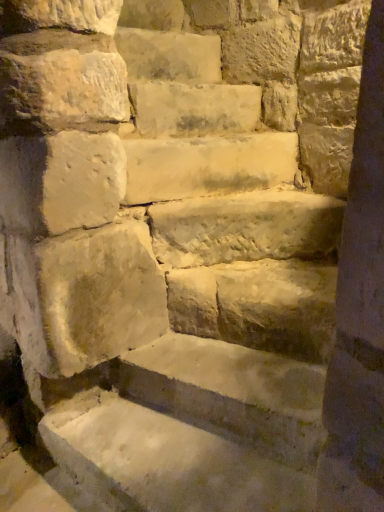
Describe the element at coordinates (245, 227) in the screenshot. The image size is (384, 512). I see `smooth beige stone steps at center` at that location.

What are the coordinates of `light beige stone at center, which is the first brick in bottom-to-top order` in the screenshot? It's located at (193, 108).

What is the approximate width of smooth beige stone at center?

smooth beige stone at center is 14.66 inches wide.

Where is `smooth beige stone steps at center`? This screenshot has height=512, width=384. smooth beige stone steps at center is located at coordinates coord(245,227).

Consider the image. Is light beige stone at upper center, marked as the 1th brick in a top-to-bottom arrangement, positioned with its back to light beige stone at center, the second brick positioned from the top?

No, light beige stone at center, the second brick positioned from the top, is not at the back of light beige stone at upper center, marked as the 1th brick in a top-to-bottom arrangement.

From the image's perspective, is light beige stone at upper center, the second brick in the bottom-to-top sequence, on light beige stone at center, which is the first brick in bottom-to-top order?

Yes, from the image's perspective, light beige stone at upper center, the second brick in the bottom-to-top sequence, is on top of light beige stone at center, which is the first brick in bottom-to-top order.

Are light beige stone at upper center, the second brick in the bottom-to-top sequence, and light beige stone at center, which is the first brick in bottom-to-top order, located far from each other?

No, light beige stone at upper center, the second brick in the bottom-to-top sequence, is not far from light beige stone at center, which is the first brick in bottom-to-top order.

Considering the relative sizes of light beige stone at upper center, marked as the 1th brick in a top-to-bottom arrangement, and light beige stone at center, the second brick positioned from the top, in the image provided, is light beige stone at upper center, marked as the 1th brick in a top-to-bottom arrangement, smaller than light beige stone at center, the second brick positioned from the top,?

Actually, light beige stone at upper center, marked as the 1th brick in a top-to-bottom arrangement, might be larger than light beige stone at center, the second brick positioned from the top.

Is smooth beige stone at center further to the viewer compared to smooth beige stone steps at center?

Yes, the depth of smooth beige stone at center is greater than that of smooth beige stone steps at center.

Who is smaller, smooth beige stone at center or smooth beige stone steps at center?

smooth beige stone at center.

Between smooth beige stone at center and smooth beige stone steps at center, which one has more height?

smooth beige stone at center.

Would you say smooth beige stone at center is a long distance from smooth beige stone steps at center?

smooth beige stone at center is actually quite close to smooth beige stone steps at center.

There is a smooth beige stone at center. In order to click on the 2nd brick above it (from the image's perspective) in this screenshot , I will do `click(170, 55)`.

How different are the orientations of smooth beige stone at center and light beige stone at upper center, marked as the 1th brick in a top-to-bottom arrangement, in degrees?

The facing directions of smooth beige stone at center and light beige stone at upper center, marked as the 1th brick in a top-to-bottom arrangement, are 13.8 degrees apart.

Considering the relative sizes of smooth beige stone at center and light beige stone at upper center, marked as the 1th brick in a top-to-bottom arrangement, in the image provided, is smooth beige stone at center bigger than light beige stone at upper center, marked as the 1th brick in a top-to-bottom arrangement,?

No, smooth beige stone at center is not bigger than light beige stone at upper center, marked as the 1th brick in a top-to-bottom arrangement.

Based on their positions, is smooth beige stone at center located to the left or right of light beige stone at upper center, the second brick in the bottom-to-top sequence?

smooth beige stone at center is positioned on light beige stone at upper center, the second brick in the bottom-to-top sequence,'s right side.

From a real-world perspective, is light beige stone at upper center, marked as the 1th brick in a top-to-bottom arrangement, positioned above or below smooth beige stone steps at center?

Clearly, from a real-world perspective, light beige stone at upper center, marked as the 1th brick in a top-to-bottom arrangement, is above smooth beige stone steps at center.

In the scene shown: From the image's perspective, which object appears higher, light beige stone at upper center, marked as the 1th brick in a top-to-bottom arrangement, or smooth beige stone steps at center?

light beige stone at upper center, marked as the 1th brick in a top-to-bottom arrangement, from the image's perspective.

Visually, is light beige stone at upper center, the second brick in the bottom-to-top sequence, positioned to the left or to the right of smooth beige stone steps at center?

light beige stone at upper center, the second brick in the bottom-to-top sequence, is positioned on smooth beige stone steps at center's left side.

Is light beige stone at upper center, the second brick in the bottom-to-top sequence, positioned far away from smooth beige stone steps at center?

Actually, light beige stone at upper center, the second brick in the bottom-to-top sequence, and smooth beige stone steps at center are a little close together.

From the image's perspective, which one is positioned higher, light beige stone at upper center, marked as the 1th brick in a top-to-bottom arrangement, or smooth beige stone at center?

light beige stone at upper center, marked as the 1th brick in a top-to-bottom arrangement, appears higher in the image.

Could you tell me if light beige stone at upper center, marked as the 1th brick in a top-to-bottom arrangement, is facing smooth beige stone at center?

No, light beige stone at upper center, marked as the 1th brick in a top-to-bottom arrangement, is not aimed at smooth beige stone at center.

From a real-world perspective, is light beige stone at upper center, the second brick in the bottom-to-top sequence, below smooth beige stone at center?

No, from a real-world perspective, light beige stone at upper center, the second brick in the bottom-to-top sequence, is not under smooth beige stone at center.

Between light beige stone at upper center, marked as the 1th brick in a top-to-bottom arrangement, and smooth beige stone at center, which one has smaller width?

Thinner between the two is light beige stone at upper center, marked as the 1th brick in a top-to-bottom arrangement.

How far apart are smooth beige stone steps at center and light beige stone at center, the second brick positioned from the top?

smooth beige stone steps at center is 21.42 inches away from light beige stone at center, the second brick positioned from the top.

Can you tell me how much smooth beige stone steps at center and light beige stone at center, which is the first brick in bottom-to-top order, differ in facing direction?

11.4 degrees.

Which object is thinner, smooth beige stone steps at center or light beige stone at center, the second brick positioned from the top?

Thinner between the two is light beige stone at center, the second brick positioned from the top.

Consider the image. Does smooth beige stone steps at center contain light beige stone at center, the second brick positioned from the top?

No, light beige stone at center, the second brick positioned from the top, is not a part of smooth beige stone steps at center.

Is smooth beige stone steps at center beside smooth beige stone at center?

They are not placed beside each other.

Which point is more forward, (227, 199) or (232, 180)?

The point (227, 199) is in front.

Can you confirm if smooth beige stone steps at center is bigger than smooth beige stone at center?

Correct, smooth beige stone steps at center is larger in size than smooth beige stone at center.

Who is shorter, smooth beige stone steps at center or smooth beige stone at center?

With less height is smooth beige stone steps at center.

This screenshot has height=512, width=384. What are the coordinates of `brick above the light beige stone at center, the second brick positioned from the top (from a real-world perspective)` in the screenshot? It's located at click(170, 55).

Where is `stone behind the smooth beige stone steps at center`? The height and width of the screenshot is (512, 384). stone behind the smooth beige stone steps at center is located at coordinates point(207,165).

Estimate the real-world distances between objects in this image. Which object is further from light beige stone at center, the second brick positioned from the top, smooth beige stone at center or smooth beige stone steps at center?

smooth beige stone steps at center.

Which object lies further to the anchor point smooth beige stone steps at center, light beige stone at upper center, marked as the 1th brick in a top-to-bottom arrangement, or smooth beige stone at center?

light beige stone at upper center, marked as the 1th brick in a top-to-bottom arrangement, lies further to smooth beige stone steps at center than the other object.

Estimate the real-world distances between objects in this image. Which object is closer to smooth beige stone at center, smooth beige stone steps at center or light beige stone at upper center, the second brick in the bottom-to-top sequence?

The object closer to smooth beige stone at center is smooth beige stone steps at center.

In the scene shown: Considering their positions, is smooth beige stone at center positioned further to light beige stone at upper center, marked as the 1th brick in a top-to-bottom arrangement, than smooth beige stone steps at center?

smooth beige stone steps at center is positioned further to the anchor light beige stone at upper center, marked as the 1th brick in a top-to-bottom arrangement.

Which object lies nearer to the anchor point light beige stone at upper center, the second brick in the bottom-to-top sequence, light beige stone at center, the second brick positioned from the top, or smooth beige stone steps at center?

light beige stone at center, the second brick positioned from the top, is closer to light beige stone at upper center, the second brick in the bottom-to-top sequence.

Based on their spatial positions, is smooth beige stone steps at center or light beige stone at center, which is the first brick in bottom-to-top order, further from light beige stone at upper center, the second brick in the bottom-to-top sequence?

smooth beige stone steps at center is further to light beige stone at upper center, the second brick in the bottom-to-top sequence.

Which object lies nearer to the anchor point smooth beige stone steps at center, light beige stone at center, the second brick positioned from the top, or light beige stone at upper center, marked as the 1th brick in a top-to-bottom arrangement?

Based on the image, light beige stone at center, the second brick positioned from the top, appears to be nearer to smooth beige stone steps at center.

From the picture: Based on their spatial positions, is light beige stone at center, the second brick positioned from the top, or light beige stone at upper center, the second brick in the bottom-to-top sequence, closer to smooth beige stone at center?

Among the two, light beige stone at center, the second brick positioned from the top, is located nearer to smooth beige stone at center.

The width and height of the screenshot is (384, 512). I want to click on brick between light beige stone at upper center, marked as the 1th brick in a top-to-bottom arrangement, and smooth beige stone at center in the up-down direction, so (x=193, y=108).

The height and width of the screenshot is (512, 384). Identify the location of stone between light beige stone at upper center, the second brick in the bottom-to-top sequence, and smooth beige stone steps at center, in the vertical direction. (207, 165).

Where is `stone between light beige stone at center, the second brick positioned from the top, and smooth beige stone steps at center, in the vertical direction`? This screenshot has height=512, width=384. stone between light beige stone at center, the second brick positioned from the top, and smooth beige stone steps at center, in the vertical direction is located at coordinates coord(207,165).

Find the location of a particular element. This screenshot has width=384, height=512. brick between light beige stone at upper center, marked as the 1th brick in a top-to-bottom arrangement, and smooth beige stone steps at center from top to bottom is located at coordinates pyautogui.click(x=193, y=108).